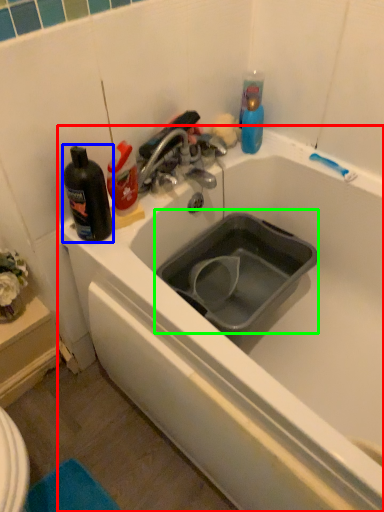
Question: Estimate the real-world distances between objects in this image. Which object is farther from bathtub (highlighted by a red box), bottle (highlighted by a blue box) or sink (highlighted by a green box)?

Choices:
 (A) bottle
 (B) sink

Answer: (A)